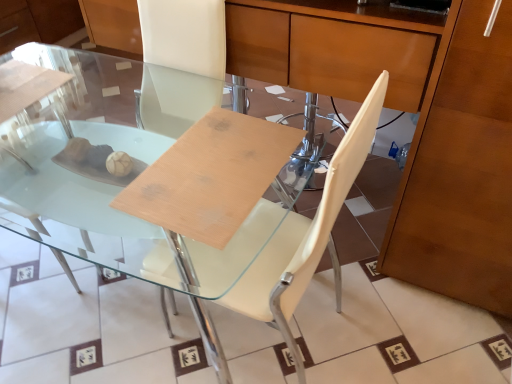
Describe the element at coordinates (112, 175) in the screenshot. I see `transparent glass table at center` at that location.

I want to click on transparent glass table at center, so click(112, 175).

This screenshot has height=384, width=512. Find the location of `white leather chair at center`. white leather chair at center is located at coordinates (305, 235).

Describe the element at coordinates (305, 235) in the screenshot. I see `white leather chair at center` at that location.

Where is `transparent glass table at center`? This screenshot has width=512, height=384. transparent glass table at center is located at coordinates (112, 175).

Can you confirm if transparent glass table at center is positioned to the left of white leather chair at center?

Correct, you'll find transparent glass table at center to the left of white leather chair at center.

Which object is closer to the camera, transparent glass table at center or white leather chair at center?

white leather chair at center is in front.

Is point (87, 251) less distant than point (166, 255)?

No, it is behind (166, 255).

From the image's perspective, which one is positioned lower, transparent glass table at center or white leather chair at center?

white leather chair at center is shown below in the image.

From a real-world perspective, is transparent glass table at center physically below white leather chair at center?

Yes, from a real-world perspective, transparent glass table at center is below white leather chair at center.

Does transparent glass table at center have a lesser width compared to white leather chair at center?

In fact, transparent glass table at center might be wider than white leather chair at center.

In terms of height, does transparent glass table at center look taller or shorter compared to white leather chair at center?

Considering their sizes, transparent glass table at center has less height than white leather chair at center.

In terms of size, does transparent glass table at center appear bigger or smaller than white leather chair at center?

Considering their sizes, transparent glass table at center takes up more space than white leather chair at center.

Looking at this image, is transparent glass table at center outside of white leather chair at center?

Yes, transparent glass table at center is located beyond the bounds of white leather chair at center.

Based on the photo, are transparent glass table at center and white leather chair at center beside each other?

There is a gap between transparent glass table at center and white leather chair at center.

Is transparent glass table at center positioned with its back to white leather chair at center?

Yes, transparent glass table at center's orientation is away from white leather chair at center.

You are a GUI agent. You are given a task and a screenshot of the screen. Output one action in this format:
    pyautogui.click(x=<x>, y=<y>)
    Task: Click on the chair that appears above the transparent glass table at center (from a real-world perspective)
    Image resolution: width=512 pixels, height=384 pixels.
    Given the screenshot: What is the action you would take?
    pyautogui.click(x=305, y=235)

Between white leather chair at center and transparent glass table at center, which one appears on the right side from the viewer's perspective?

Positioned to the right is white leather chair at center.

Considering their positions, is white leather chair at center located in front of or behind transparent glass table at center?

white leather chair at center is positioned closer to the viewer than transparent glass table at center.

Is point (324, 238) less distant than point (86, 130)?

Yes.

From the image's perspective, which one is positioned higher, white leather chair at center or transparent glass table at center?

From the image's view, transparent glass table at center is above.

From a real-world perspective, who is located higher, white leather chair at center or transparent glass table at center?

From a 3D spatial view, white leather chair at center is above.

Between white leather chair at center and transparent glass table at center, which one has larger width?

Wider between the two is transparent glass table at center.

Considering the relative sizes of white leather chair at center and transparent glass table at center in the image provided, is white leather chair at center taller than transparent glass table at center?

Correct, white leather chair at center is much taller as transparent glass table at center.

Considering the relative sizes of white leather chair at center and transparent glass table at center in the image provided, is white leather chair at center bigger than transparent glass table at center?

Incorrect, white leather chair at center is not larger than transparent glass table at center.

Is white leather chair at center inside or outside of transparent glass table at center?

white leather chair at center is located inside transparent glass table at center.

Is white leather chair at center not near transparent glass table at center?

No, white leather chair at center is in close proximity to transparent glass table at center.

Could you tell me if white leather chair at center is turned towards transparent glass table at center?

Yes, white leather chair at center is turned towards transparent glass table at center.

Identify the location of chair that appears in front of the transparent glass table at center. (305, 235).

Locate an element on the screen. The width and height of the screenshot is (512, 384). chair that appears on the right of transparent glass table at center is located at coordinates (305, 235).

You are a GUI agent. You are given a task and a screenshot of the screen. Output one action in this format:
    pyautogui.click(x=<x>, y=<y>)
    Task: Click on the table on the left of the white leather chair at center
    Image resolution: width=512 pixels, height=384 pixels.
    Given the screenshot: What is the action you would take?
    pyautogui.click(x=112, y=175)